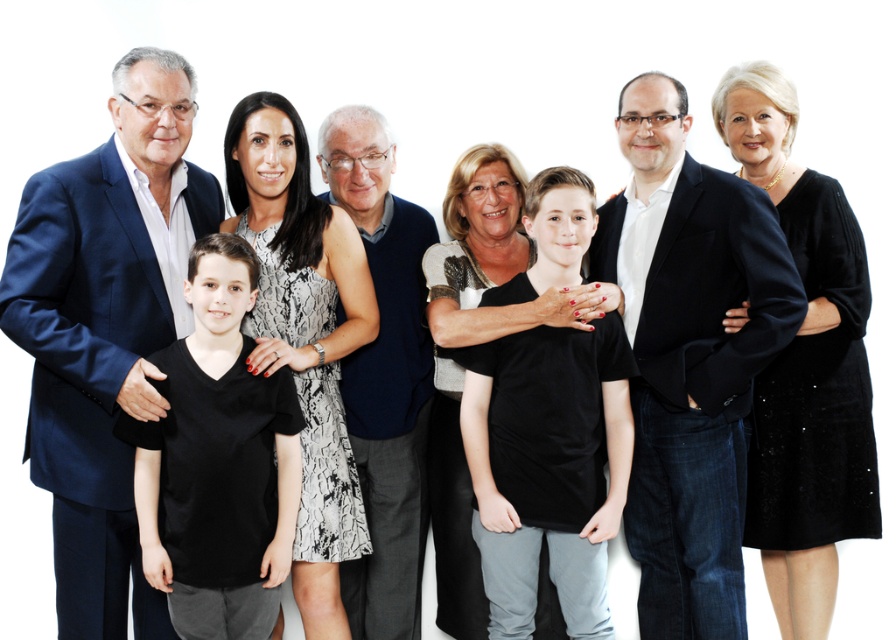
Is navy blue suit at left positioned before dark blue sweater at center?

Yes, it is.

Is navy blue suit at left above dark blue sweater at center?

Yes, navy blue suit at left is above dark blue sweater at center.

Describe the element at coordinates (105, 330) in the screenshot. The image size is (896, 640). I see `navy blue suit at left` at that location.

The width and height of the screenshot is (896, 640). What are the coordinates of `navy blue suit at left` in the screenshot? It's located at (105, 330).

The height and width of the screenshot is (640, 896). What are the coordinates of `navy blue suit at left` in the screenshot? It's located at (105, 330).

Is navy blue suit at left bigger than matte black suit at center?

No.

Which is behind, point (63, 195) or point (666, 164)?

Positioned behind is point (666, 164).

Locate an element on the screen. The image size is (896, 640). navy blue suit at left is located at coordinates (105, 330).

Which is above, matte black suit at center or black matte t-shirt at center?

matte black suit at center is higher up.

Can you confirm if matte black suit at center is wider than black matte t-shirt at center?

Indeed, matte black suit at center has a greater width compared to black matte t-shirt at center.

At what (x,y) coordinates should I click in order to perform the action: click on matte black suit at center. Please return your answer as a coordinate pair (x, y). This screenshot has height=640, width=896. Looking at the image, I should click on (690, 358).